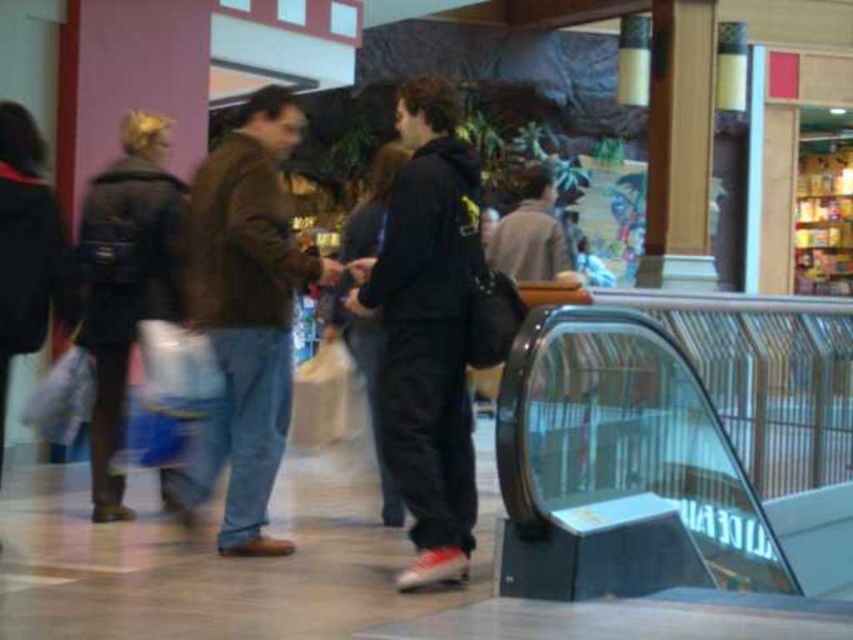
Is dark gray hoodie at center bigger than brown leather jacket at left?

Actually, dark gray hoodie at center might be smaller than brown leather jacket at left.

Who is positioned more to the right, dark gray hoodie at center or brown leather jacket at left?

Positioned to the right is dark gray hoodie at center.

What do you see at coordinates (426, 330) in the screenshot? This screenshot has height=640, width=853. I see `dark gray hoodie at center` at bounding box center [426, 330].

What are the coordinates of `dark gray hoodie at center` in the screenshot? It's located at (426, 330).